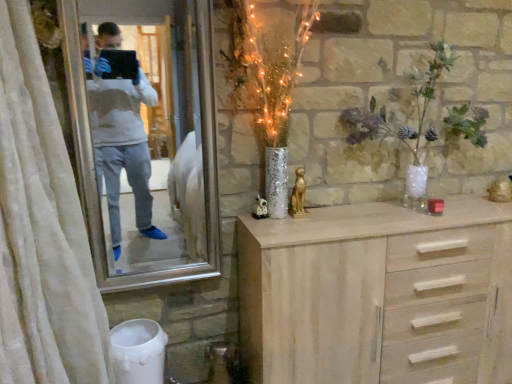
Question: Does silver metallic mirror at upper left lie in front of light wood chest of drawers at center?

Choices:
 (A) no
 (B) yes

Answer: (B)

Question: Does silver metallic mirror at upper left have a lesser width compared to light wood chest of drawers at center?

Choices:
 (A) yes
 (B) no

Answer: (A)

Question: Is silver metallic mirror at upper left to the left of light wood chest of drawers at center from the viewer's perspective?

Choices:
 (A) yes
 (B) no

Answer: (A)

Question: Is light wood chest of drawers at center at the back of silver metallic mirror at upper left?

Choices:
 (A) no
 (B) yes

Answer: (A)

Question: Is silver metallic mirror at upper left not close to light wood chest of drawers at center?

Choices:
 (A) no
 (B) yes

Answer: (B)

Question: Which is correct: light wood chest of drawers at center is inside silver metallic mirror at upper left, or outside of it?

Choices:
 (A) outside
 (B) inside

Answer: (A)

Question: From their relative heights in the image, would you say light wood chest of drawers at center is taller or shorter than silver metallic mirror at upper left?

Choices:
 (A) short
 (B) tall

Answer: (A)

Question: Is light wood chest of drawers at center to the left or to the right of silver metallic mirror at upper left in the image?

Choices:
 (A) left
 (B) right

Answer: (B)

Question: Is light wood chest of drawers at center in front of or behind silver metallic mirror at upper left in the image?

Choices:
 (A) behind
 (B) front

Answer: (A)

Question: From a real-world perspective, relative to light wood chest of drawers at center, is white textured curtain at left vertically above or below?

Choices:
 (A) above
 (B) below

Answer: (A)

Question: Considering the positions of point (20, 59) and point (324, 236), is point (20, 59) closer or farther from the camera than point (324, 236)?

Choices:
 (A) farther
 (B) closer

Answer: (B)

Question: Considering the relative positions of white textured curtain at left and light wood chest of drawers at center in the image provided, is white textured curtain at left to the left or to the right of light wood chest of drawers at center?

Choices:
 (A) right
 (B) left

Answer: (B)

Question: From the image's perspective, relative to light wood chest of drawers at center, is white textured curtain at left above or below?

Choices:
 (A) above
 (B) below

Answer: (A)

Question: Considering their positions, is translucent glass vase at upper right located in front of or behind light wood chest of drawers at center?

Choices:
 (A) front
 (B) behind

Answer: (B)

Question: From a real-world perspective, is translucent glass vase at upper right above or below light wood chest of drawers at center?

Choices:
 (A) above
 (B) below

Answer: (A)